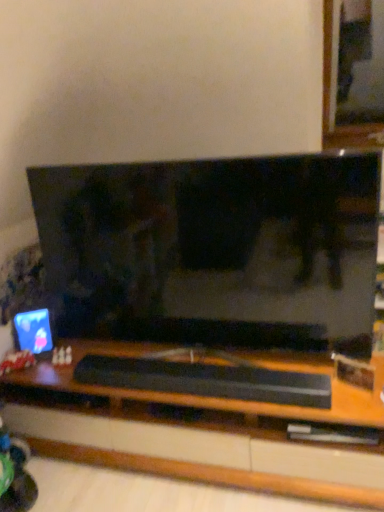
Measure the distance between black matte soundbar at center and camera.

They are 1.59 meters apart.

The image size is (384, 512). Identify the location of black matte soundbar at center. (206, 380).

Can you see black glossy television at center touching matte plastic computer monitor at left?

black glossy television at center and matte plastic computer monitor at left are not in contact.

Image resolution: width=384 pixels, height=512 pixels. I want to click on television in front of the matte plastic computer monitor at left, so click(214, 250).

Considering their positions, is black glossy television at center located in front of or behind matte plastic computer monitor at left?

black glossy television at center is in front of matte plastic computer monitor at left.

Is black glossy television at center completely or partially outside of matte plastic computer monitor at left?

Indeed, black glossy television at center is completely outside matte plastic computer monitor at left.

Between point (111, 225) and point (215, 397), which one is positioned in front?

The point (215, 397) is closer to the camera.

Does black glossy television at center have a lesser height compared to black matte soundbar at center?

No.

Would you say black matte soundbar at center is part of black glossy television at center's contents?

No, black matte soundbar at center is located outside of black glossy television at center.

Looking at the image, does black glossy television at center seem bigger or smaller compared to black matte soundbar at center?

black glossy television at center is bigger than black matte soundbar at center.

Looking at this image, is plush fabric teddy bear at lower left inside or outside of black glossy television at center?

plush fabric teddy bear at lower left is not enclosed by black glossy television at center.

In the scene shown: From a real-world perspective, is plush fabric teddy bear at lower left located beneath black glossy television at center?

Yes, from a real-world perspective, plush fabric teddy bear at lower left is below black glossy television at center.

Considering the sizes of objects plush fabric teddy bear at lower left and black glossy television at center in the image provided, who is smaller, plush fabric teddy bear at lower left or black glossy television at center?

plush fabric teddy bear at lower left.

Is plush fabric teddy bear at lower left to the right of black matte soundbar at center from the viewer's perspective?

No.

Does plush fabric teddy bear at lower left have a larger size compared to black matte soundbar at center?

No, plush fabric teddy bear at lower left is not bigger than black matte soundbar at center.

Is plush fabric teddy bear at lower left inside the boundaries of black matte soundbar at center, or outside?

plush fabric teddy bear at lower left is located beyond the bounds of black matte soundbar at center.

Measure the distance from plush fabric teddy bear at lower left to black matte soundbar at center.

plush fabric teddy bear at lower left is 26.44 inches from black matte soundbar at center.

At what (x,y) coordinates should I click in order to perform the action: click on television located on the right of matte plastic computer monitor at left. Please return your answer as a coordinate pair (x, y). This screenshot has width=384, height=512. Looking at the image, I should click on (214, 250).

Is black glossy television at center at the back of matte plastic computer monitor at left?

No, matte plastic computer monitor at left is not facing away from black glossy television at center.

Is matte plastic computer monitor at left at the left side of black glossy television at center?

Indeed, matte plastic computer monitor at left is positioned on the left side of black glossy television at center.

From the picture: Which is in front, black matte soundbar at center or matte plastic computer monitor at left?

black matte soundbar at center.

Considering the positions of point (109, 359) and point (32, 315), is point (109, 359) closer or farther from the camera than point (32, 315)?

Point (109, 359) appears to be closer to the viewer than point (32, 315).

From a real-world perspective, is black matte soundbar at center physically located above or below matte plastic computer monitor at left?

black matte soundbar at center is below matte plastic computer monitor at left.

Who is smaller, black matte soundbar at center or matte plastic computer monitor at left?

matte plastic computer monitor at left.

Can you confirm if plush fabric teddy bear at lower left is smaller than matte plastic computer monitor at left?

Yes.

From the image's perspective, which is below, plush fabric teddy bear at lower left or matte plastic computer monitor at left?

From the image's view, plush fabric teddy bear at lower left is below.

Can you tell me how much plush fabric teddy bear at lower left and matte plastic computer monitor at left differ in facing direction?

9.58 degrees.

Is point (26, 365) positioned behind point (20, 321)?

No.

You are a GUI agent. You are given a task and a screenshot of the screen. Output one action in this format:
    pyautogui.click(x=<x>, y=<y>)
    Task: Click on the television lying in front of the matte plastic computer monitor at left
    The height and width of the screenshot is (512, 384).
    Given the screenshot: What is the action you would take?
    pyautogui.click(x=214, y=250)

Where is `television above the black matte soundbar at center (from a real-world perspective)`? The height and width of the screenshot is (512, 384). television above the black matte soundbar at center (from a real-world perspective) is located at coordinates (214, 250).

Which object lies nearer to the anchor point matte plastic computer monitor at left, black matte soundbar at center or plush fabric teddy bear at lower left?

Based on the image, plush fabric teddy bear at lower left appears to be nearer to matte plastic computer monitor at left.

From the image, which object appears to be farther from black glossy television at center, black matte soundbar at center or matte plastic computer monitor at left?

matte plastic computer monitor at left lies further to black glossy television at center than the other object.

Based on their spatial positions, is black glossy television at center or matte plastic computer monitor at left closer to plush fabric teddy bear at lower left?

matte plastic computer monitor at left lies closer to plush fabric teddy bear at lower left than the other object.

In the scene shown: When comparing their distances from matte plastic computer monitor at left, does black glossy television at center or plush fabric teddy bear at lower left seem further?

Based on the image, black glossy television at center appears to be further to matte plastic computer monitor at left.

Which object lies nearer to the anchor point plush fabric teddy bear at lower left, black matte soundbar at center or black glossy television at center?

black matte soundbar at center.

Based on their spatial positions, is plush fabric teddy bear at lower left or matte plastic computer monitor at left closer to black matte soundbar at center?

Based on the image, matte plastic computer monitor at left appears to be nearer to black matte soundbar at center.

From the image, which object appears to be farther from plush fabric teddy bear at lower left, matte plastic computer monitor at left or black matte soundbar at center?

Among the two, black matte soundbar at center is located further to plush fabric teddy bear at lower left.

Estimate the real-world distances between objects in this image. Which object is further from plush fabric teddy bear at lower left, matte plastic computer monitor at left or black glossy television at center?

black glossy television at center lies further to plush fabric teddy bear at lower left than the other object.

Locate an element on the screen. This screenshot has height=512, width=384. wide located between plush fabric teddy bear at lower left and black glossy television at center in the left-right direction is located at coordinates (206, 380).

Where is `computer monitor between plush fabric teddy bear at lower left and black glossy television at center from left to right`? The image size is (384, 512). computer monitor between plush fabric teddy bear at lower left and black glossy television at center from left to right is located at coordinates (33, 331).

This screenshot has height=512, width=384. In order to click on computer monitor located between plush fabric teddy bear at lower left and black matte soundbar at center in the left-right direction in this screenshot , I will do pos(33,331).

The width and height of the screenshot is (384, 512). Identify the location of wide between matte plastic computer monitor at left and black glossy television at center. (206, 380).